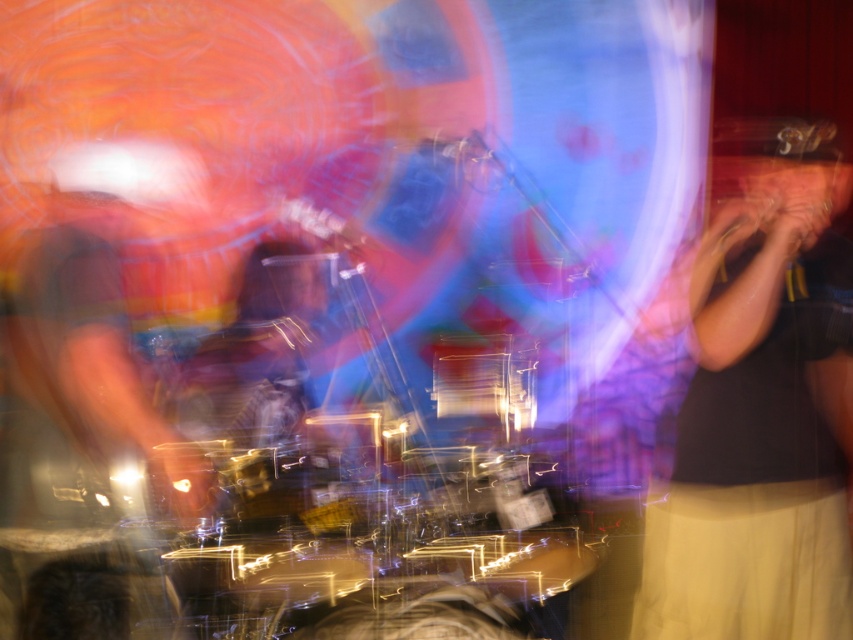
You are a photographer at the event and want to capture a clear shot of both the black fabric shirt at right and the clear plastic drum at center. Since the scene is dynamic, you need to adjust your focus. Which object should you focus on first to ensure it appears larger in the photo?

The black fabric shirt at right is taller than the clear plastic drum at center, so focusing on the black fabric shirt at right first will ensure it appears larger in the photo.

You are a stagehand who needs to place a 3.5 feet long pole between the black fabric shirt at right and the clear plastic drum at center. Is there enough space to fit the pole horizontally between them?

The black fabric shirt at right is 4.15 feet from the clear plastic drum at center. Since the pole is 3.5 feet long, which is shorter than the distance between them, there is enough space to fit the pole horizontally between the black fabric shirt at right and the clear plastic drum at center.

You are at a party and want to take a photo of the clear plastic drum at center without the black fabric shirt at right appearing in the shot. How can you adjust your position to achieve this?

Since the black fabric shirt at right is positioned under the clear plastic drum at center, you can move your camera angle upwards to avoid capturing the black fabric shirt at right while keeping the clear plastic drum at center in view.